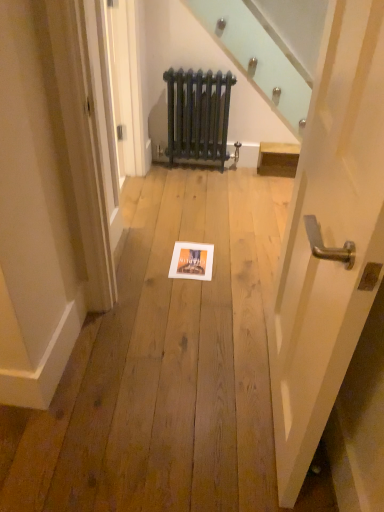
You are a GUI agent. You are given a task and a screenshot of the screen. Output one action in this format:
    pyautogui.click(x=<x>, y=<y>)
    Task: Click on the spots to the right of matte white picture frame at center
    
    Given the screenshot: What is the action you would take?
    pyautogui.click(x=241, y=268)